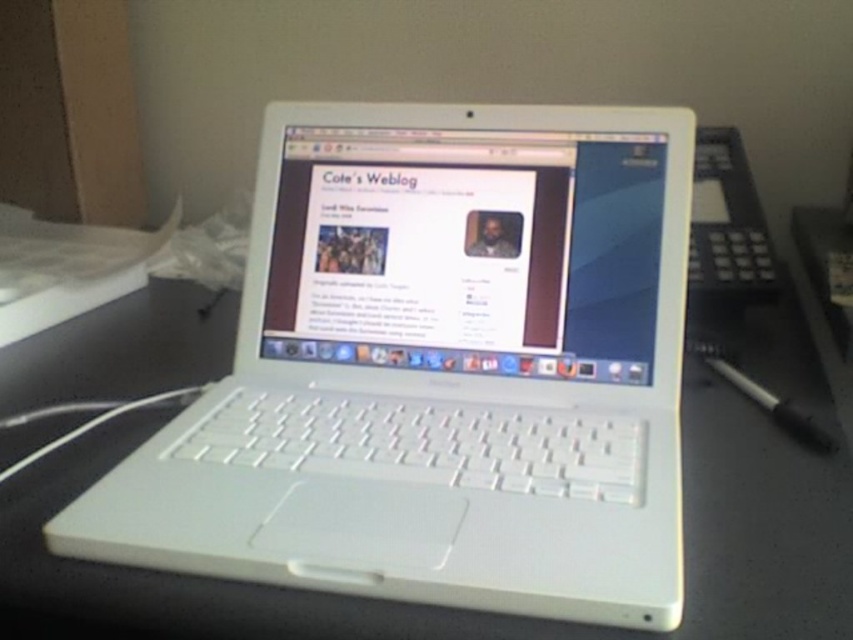
Consider the image. You are organizing your desk and need to place a new keyboard between the white plastic laptop at center and the white glossy laptop screen at center. Based on their positions, where should the keyboard be placed?

The white plastic laptop at center is below the white glossy laptop screen at center, so the keyboard should be placed below the white glossy laptop screen at center and above the white plastic laptop at center to fit between them.